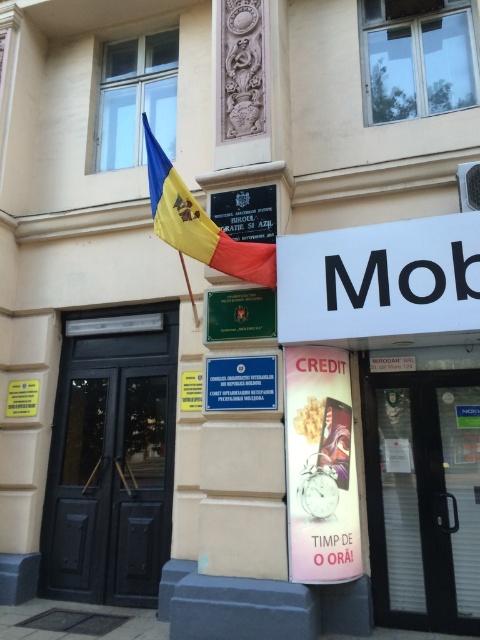
Which is in front, point (436, 628) or point (181, 388)?

Positioned in front is point (436, 628).

Does black glass door at lower right appear on the right side of blue plastic sign at upper center?

Indeed, black glass door at lower right is positioned on the right side of blue plastic sign at upper center.

You are a GUI agent. You are given a task and a screenshot of the screen. Output one action in this format:
    pyautogui.click(x=<x>, y=<y>)
    Task: Click on the black glass door at lower right
    
    Given the screenshot: What is the action you would take?
    pyautogui.click(x=423, y=499)

Is the position of black wooden door at left less distant than that of blue plastic sign at center?

That is False.

Is black wooden door at left below blue plastic sign at center?

Yes.

I want to click on black wooden door at left, so click(x=111, y=460).

Which is below, black wooden door at left or green matte sign at center?

black wooden door at left is below.

Looking at this image, who is positioned more to the left, black wooden door at left or green matte sign at center?

black wooden door at left is more to the left.

This screenshot has height=640, width=480. What do you see at coordinates (111, 460) in the screenshot? I see `black wooden door at left` at bounding box center [111, 460].

This screenshot has width=480, height=640. What are the coordinates of `black wooden door at left` in the screenshot? It's located at (111, 460).